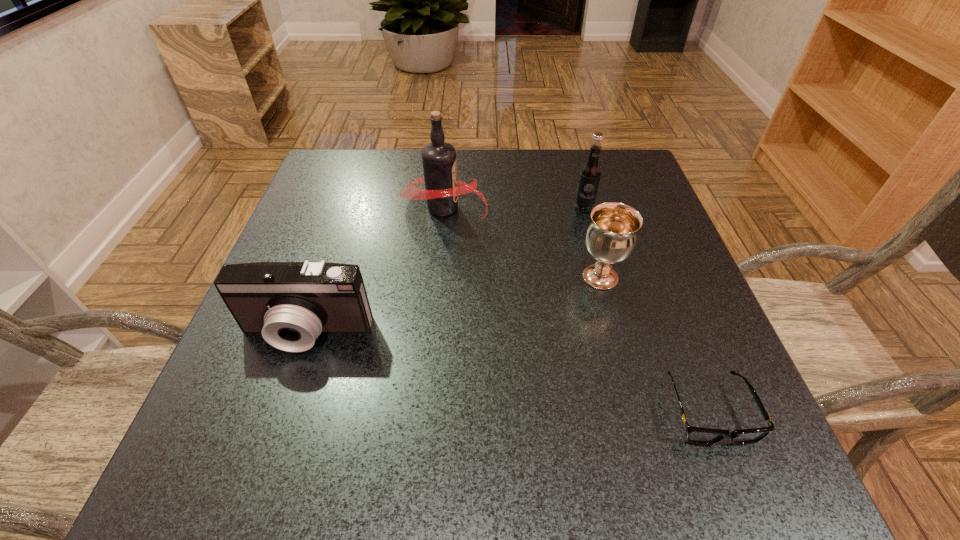
Locate an element on the screen. The height and width of the screenshot is (540, 960). vacant space situated 0.170m on the label of the right root beer is located at coordinates (600, 265).

Where is `vacant point located on the back of the chalice`? vacant point located on the back of the chalice is located at coordinates (587, 226).

Where is `vacant space located on the lens of the leftmost object`? This screenshot has height=540, width=960. vacant space located on the lens of the leftmost object is located at coordinates (263, 461).

Find the location of `object that is at the near edge`. object that is at the near edge is located at coordinates (695, 435).

Where is `object that is positioned at the left edge`? This screenshot has height=540, width=960. object that is positioned at the left edge is located at coordinates (290, 303).

The width and height of the screenshot is (960, 540). I want to click on root beer that is at the right edge, so click(590, 173).

You are a GUI agent. You are given a task and a screenshot of the screen. Output one action in this format:
    pyautogui.click(x=<x>, y=<y>)
    Task: Click on the chalice situated at the right edge
    
    Given the screenshot: What is the action you would take?
    pyautogui.click(x=611, y=237)

This screenshot has width=960, height=540. I want to click on sunglasses that is at the right edge, so click(x=695, y=435).

Locate an element on the screen. object that is at the far right corner is located at coordinates (590, 173).

You are a GUI agent. You are given a task and a screenshot of the screen. Output one action in this format:
    pyautogui.click(x=<x>, y=<y>)
    Task: Click on the object present at the near right corner
    The height and width of the screenshot is (540, 960).
    Given the screenshot: What is the action you would take?
    pyautogui.click(x=695, y=435)